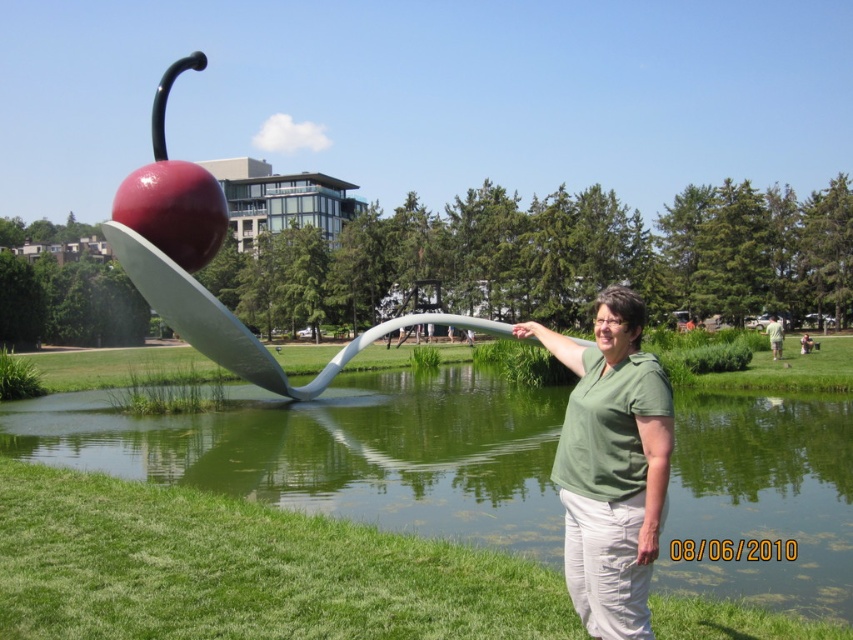
Question: Based on their relative distances, which object is nearer to the green matte shirt at center?

Choices:
 (A) green liquid water at lower center
 (B) glossy red apple at center

Answer: (A)

Question: Is green liquid water at lower center further to the viewer compared to glossy red apple at center?

Choices:
 (A) no
 (B) yes

Answer: (A)

Question: Is green matte shirt at center to the left of glossy red apple at center from the viewer's perspective?

Choices:
 (A) yes
 (B) no

Answer: (B)

Question: Is green matte shirt at center smaller than glossy red apple at center?

Choices:
 (A) no
 (B) yes

Answer: (B)

Question: Among these points, which one is farthest from the camera?

Choices:
 (A) (613, 532)
 (B) (805, 515)

Answer: (B)

Question: Estimate the real-world distances between objects in this image. Which object is farther from the green matte shirt at center?

Choices:
 (A) green liquid water at lower center
 (B) glossy red apple at center

Answer: (B)